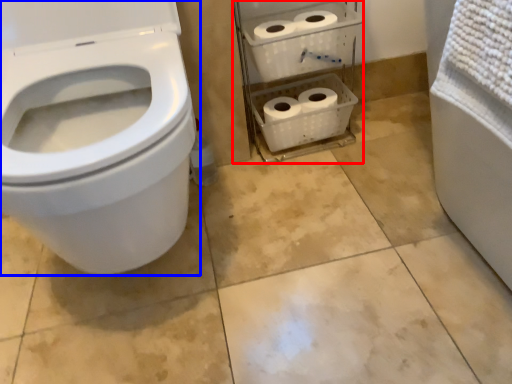
Question: Which of the following is the closest to the observer, shelf (highlighted by a red box) or toilet (highlighted by a blue box)?

Choices:
 (A) shelf
 (B) toilet

Answer: (B)